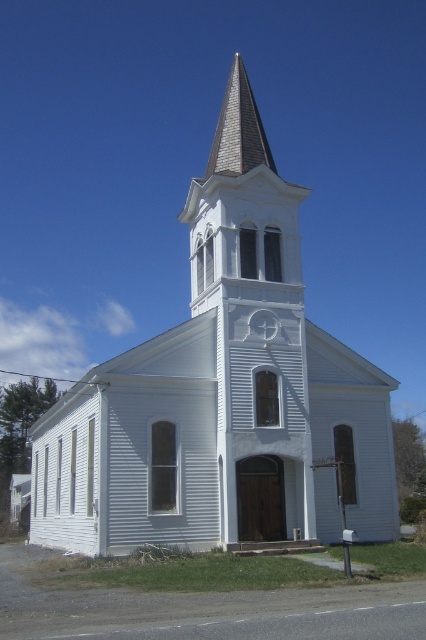
Does white wooden church at center have a smaller size compared to gray shingles steeple at center?

Incorrect, white wooden church at center is not smaller in size than gray shingles steeple at center.

Does point (227, 532) come farther from viewer compared to point (236, 157)?

That is False.

At what (x,y) coordinates should I click in order to perform the action: click on white wooden church at center. Please return your answer as a coordinate pair (x, y). This screenshot has height=640, width=426. Looking at the image, I should click on (222, 392).

Looking at this image, between gray shingles steeple at center and gray shingles at upper center, which one appears on the left side from the viewer's perspective?

Positioned to the left is gray shingles steeple at center.

Find the location of a particular element. gray shingles steeple at center is located at coordinates (241, 211).

Does white wooden church at center lie behind gray shingles at upper center?

That is False.

Does point (206, 243) lie in front of point (255, 148)?

Yes, point (206, 243) is closer to viewer.

This screenshot has height=640, width=426. I want to click on white wooden church at center, so click(x=222, y=392).